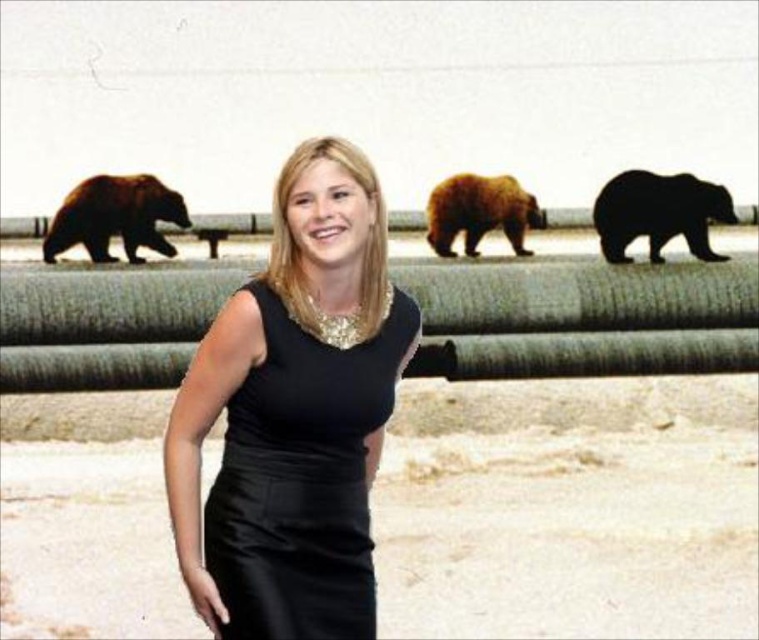
You are taking a photo of the person in the black dress and the two brown furry bears. The photographer wants to ensure that the brown furry bear at left and the brown furry bear at center are both visible in the frame. Based on their positions, which bear should be closer to the left edge of the photo?

The brown furry bear at left is to the left of the brown furry bear at center, so to ensure both are visible, the brown furry bear at left should be positioned closer to the left edge of the photo.

You are a photographer setting up a shoot in a gymnasium with bleachers. You notice two bears in the background. The black fur bear at upper center and the brown furry bear at center. Which bear is positioned lower in the frame?

The black fur bear at upper center is located below the brown furry bear at center, so the black fur bear at upper center is positioned lower in the frame.

You are a photographer setting up for a photoshoot in a gymnasium. You notice two brown furry bears on the bleachers in the background. The bears are labeled as the brown furry bear at left and the brown furry bear at center. Which bear is positioned lower in the bleachers?

The brown furry bear at left is positioned lower in the bleachers because it is located below the brown furry bear at center.